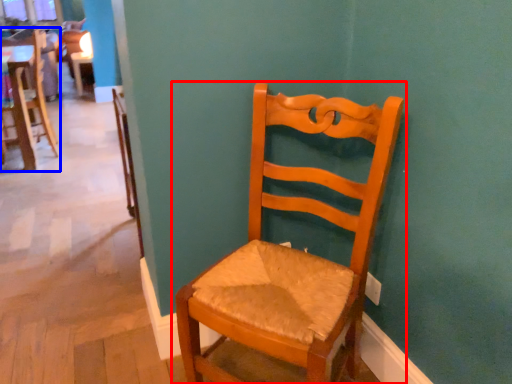
Question: Among these objects, which one is farthest to the camera, chair (highlighted by a red box) or chair (highlighted by a blue box)?

Choices:
 (A) chair
 (B) chair

Answer: (B)